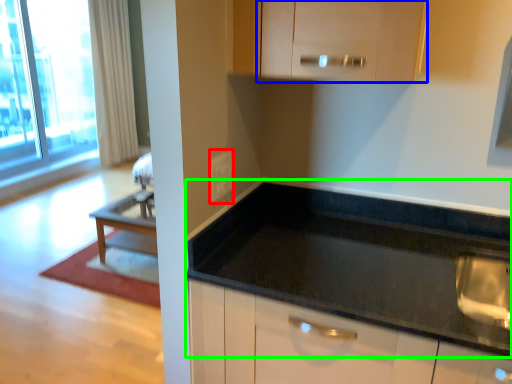
Question: Which object is the closest to the electric outlet (highlighted by a red box)? Choose among these: cabinetry (highlighted by a blue box) or countertop (highlighted by a green box).

Choices:
 (A) cabinetry
 (B) countertop

Answer: (B)